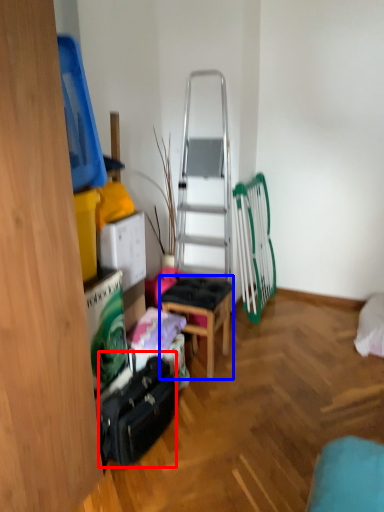
Question: Among these objects, which one is nearest to the camera, luggage (highlighted by a red box) or stool (highlighted by a blue box)?

Choices:
 (A) luggage
 (B) stool

Answer: (A)